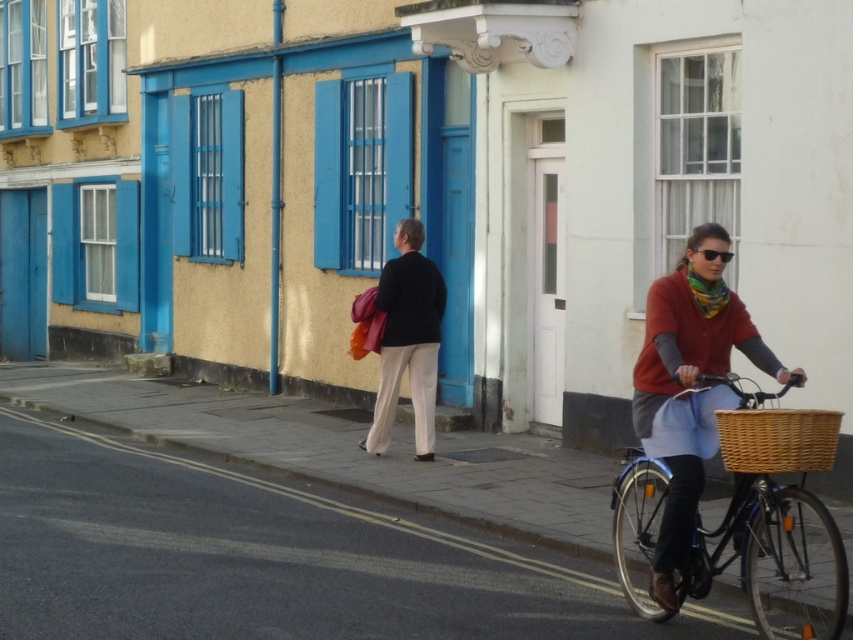
You are a fashion designer observing the scene. You notice the matte red sweater at center and the black plastic sunglasses at center. Which item would you say is bigger in size?

The matte red sweater at center has a larger size compared to the black plastic sunglasses at center, so the matte red sweater at center is bigger.

Consider the image. You are a fashion designer observing the scene. You notice the matte red sweater at center and the multicolored knitted scarf at center. Which clothing item is closer to the observer?

The matte red sweater at center is closer to the observer because it is in front of the multicolored knitted scarf at center.

You are standing at the point with coordinates (408, 339). What object are you standing on?

The point with coordinates (408, 339) corresponds to the black matte jacket at center.